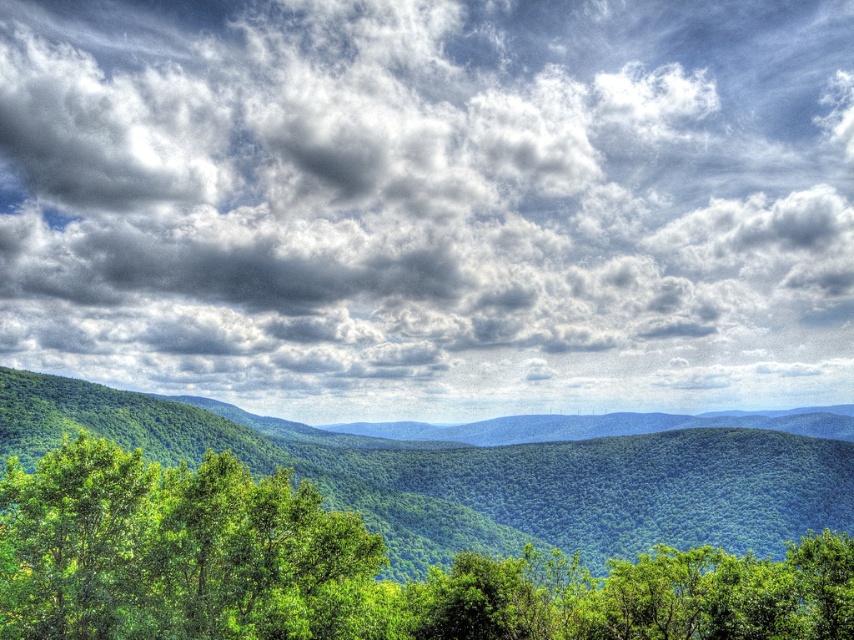
Is cloudy sky at upper center positioned before green leafy tree at lower left?

No, it is not.

Who is shorter, cloudy sky at upper center or green leafy tree at lower left?

green leafy tree at lower left is shorter.

Which is in front, point (420, 145) or point (79, 540)?

Point (79, 540)

The width and height of the screenshot is (854, 640). I want to click on cloudy sky at upper center, so pos(431,204).

Between cloudy sky at upper center and green leafy tree at center, which one is positioned lower?

green leafy tree at center is lower down.

Between cloudy sky at upper center and green leafy tree at center, which one is positioned higher?

cloudy sky at upper center

Image resolution: width=854 pixels, height=640 pixels. I want to click on cloudy sky at upper center, so click(x=431, y=204).

Can you confirm if green leafy tree at center is positioned above green leafy tree at lower left?

No.

Who is more forward, (452, 563) or (144, 509)?

Point (144, 509) is more forward.

What are the coordinates of `green leafy tree at center` in the screenshot? It's located at (349, 568).

Where is `green leafy tree at center`? The height and width of the screenshot is (640, 854). green leafy tree at center is located at coordinates (349, 568).